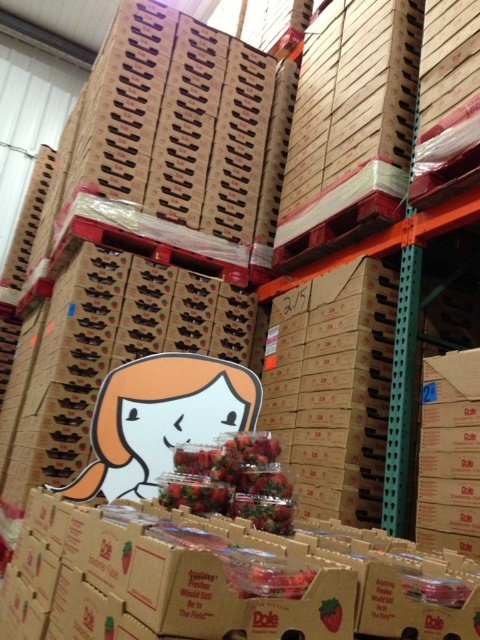
Who is higher up, shiny red strawberries at center or smooth red strawberry at center?

Positioned higher is shiny red strawberries at center.

Between shiny red strawberries at center and smooth red strawberry at center, which one appears on the right side from the viewer's perspective?

Positioned to the right is smooth red strawberry at center.

This screenshot has width=480, height=640. In order to click on shiny red strawberries at center in this screenshot , I will do `click(232, 481)`.